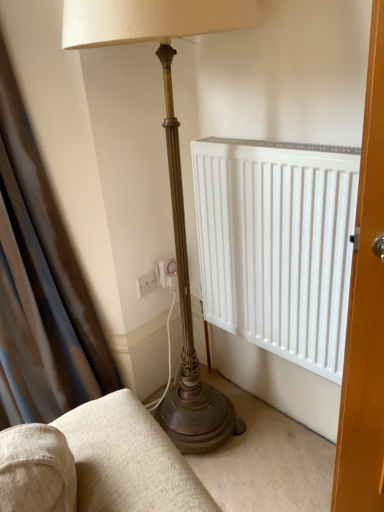
Question: Is the depth of white plastic electric outlet at lower center less than that of satin dark brown curtain at left?

Choices:
 (A) no
 (B) yes

Answer: (A)

Question: Could satin dark brown curtain at left be considered to be inside white plastic electric outlet at lower center?

Choices:
 (A) no
 (B) yes

Answer: (A)

Question: From the image's perspective, is white plastic electric outlet at lower center located beneath satin dark brown curtain at left?

Choices:
 (A) no
 (B) yes

Answer: (B)

Question: From a real-world perspective, is white plastic electric outlet at lower center located higher than satin dark brown curtain at left?

Choices:
 (A) no
 (B) yes

Answer: (A)

Question: Can you confirm if white plastic electric outlet at lower center is taller than satin dark brown curtain at left?

Choices:
 (A) yes
 (B) no

Answer: (B)

Question: Is white plastic electric outlet at lower center positioned with its back to satin dark brown curtain at left?

Choices:
 (A) no
 (B) yes

Answer: (A)

Question: Can we say satin dark brown curtain at left lies outside white plastic electric outlet at lower center?

Choices:
 (A) yes
 (B) no

Answer: (A)

Question: Does satin dark brown curtain at left have a smaller size compared to white plastic electric outlet at lower center?

Choices:
 (A) yes
 (B) no

Answer: (B)

Question: Is satin dark brown curtain at left looking in the opposite direction of white plastic electric outlet at lower center?

Choices:
 (A) yes
 (B) no

Answer: (B)

Question: Considering the relative sizes of satin dark brown curtain at left and white plastic electric outlet at lower center in the image provided, is satin dark brown curtain at left taller than white plastic electric outlet at lower center?

Choices:
 (A) no
 (B) yes

Answer: (B)

Question: Considering the relative sizes of satin dark brown curtain at left and white plastic electric outlet at lower center in the image provided, is satin dark brown curtain at left bigger than white plastic electric outlet at lower center?

Choices:
 (A) no
 (B) yes

Answer: (B)

Question: Is satin dark brown curtain at left at the right side of white plastic electric outlet at lower center?

Choices:
 (A) no
 (B) yes

Answer: (A)

Question: In terms of height, does white plastic electric outlet at lower center look taller or shorter compared to satin dark brown curtain at left?

Choices:
 (A) tall
 (B) short

Answer: (B)